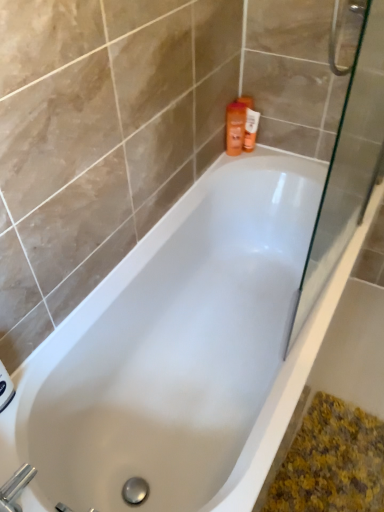
Question: From a real-world perspective, is orange matte bottle at upper right below white glossy bathtub at center?

Choices:
 (A) no
 (B) yes

Answer: (A)

Question: Are orange matte bottle at upper right and white glossy bathtub at center located far from each other?

Choices:
 (A) yes
 (B) no

Answer: (B)

Question: Is orange matte bottle at upper right in front of white glossy bathtub at center?

Choices:
 (A) yes
 (B) no

Answer: (B)

Question: Is white glossy bathtub at center inside orange matte bottle at upper right?

Choices:
 (A) no
 (B) yes

Answer: (A)

Question: Is orange matte bottle at upper right wider than white glossy bathtub at center?

Choices:
 (A) yes
 (B) no

Answer: (B)

Question: Is orange matte bottle at upper right taller than white glossy bathtub at center?

Choices:
 (A) yes
 (B) no

Answer: (B)

Question: Is orange plastic bottle at upper right surrounded by silver metallic faucet at lower left?

Choices:
 (A) yes
 (B) no

Answer: (B)

Question: Can you confirm if silver metallic faucet at lower left is smaller than orange plastic bottle at upper right?

Choices:
 (A) yes
 (B) no

Answer: (B)

Question: From the image's perspective, is silver metallic faucet at lower left beneath orange plastic bottle at upper right?

Choices:
 (A) yes
 (B) no

Answer: (A)

Question: Does silver metallic faucet at lower left have a lesser height compared to orange plastic bottle at upper right?

Choices:
 (A) yes
 (B) no

Answer: (A)

Question: Is silver metallic faucet at lower left at the left side of orange plastic bottle at upper right?

Choices:
 (A) yes
 (B) no

Answer: (A)

Question: Is silver metallic faucet at lower left to the right of orange plastic bottle at upper right from the viewer's perspective?

Choices:
 (A) no
 (B) yes

Answer: (A)

Question: Is transparent glass screen door at right to the left of orange plastic bottle at upper right from the viewer's perspective?

Choices:
 (A) yes
 (B) no

Answer: (B)